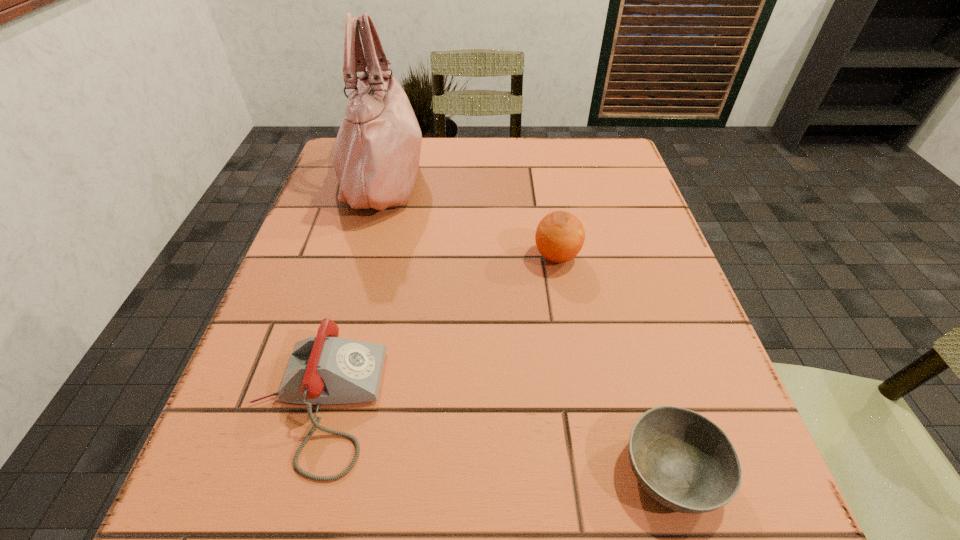
Where is `empty space that is in between the third nearest object and the shortest object`? This screenshot has width=960, height=540. empty space that is in between the third nearest object and the shortest object is located at coordinates (614, 363).

Locate an element on the screen. The height and width of the screenshot is (540, 960). vacant point located between the tallest object and the shortest object is located at coordinates (527, 323).

Image resolution: width=960 pixels, height=540 pixels. What are the coordinates of `free space between the third tallest object and the farthest object` in the screenshot? It's located at (349, 290).

I want to click on vacant space in between the third nearest object and the telephone, so click(x=436, y=330).

Find the location of a particular element. unoccupied position between the tallest object and the shortest object is located at coordinates (527, 323).

Identify which object is the closest to the shortest object. Please provide its 2D coordinates. Your answer should be formatted as a tuple, i.e. [(x, y)], where the tuple contains the x and y coordinates of a point satisfying the conditions above.

[(560, 235)]

Locate which object is the closest to the second shortest object. Please provide its 2D coordinates. Your answer should be formatted as a tuple, i.e. [(x, y)], where the tuple contains the x and y coordinates of a point satisfying the conditions above.

[(376, 158)]

Locate an element on the screen. The width and height of the screenshot is (960, 540). free space that satisfies the following two spatial constraints: 1. at the front of the farthest object with handles; 2. on the back side of the orange is located at coordinates (361, 256).

In order to click on vacant space that satisfies the following two spatial constraints: 1. at the front of the shortest object with handles; 2. on the right side of the tallest object in this screenshot , I will do `click(302, 470)`.

The image size is (960, 540). In order to click on free spot that satisfies the following two spatial constraints: 1. at the front of the third shortest object with handles; 2. on the left side of the farthest object in this screenshot , I will do `click(361, 256)`.